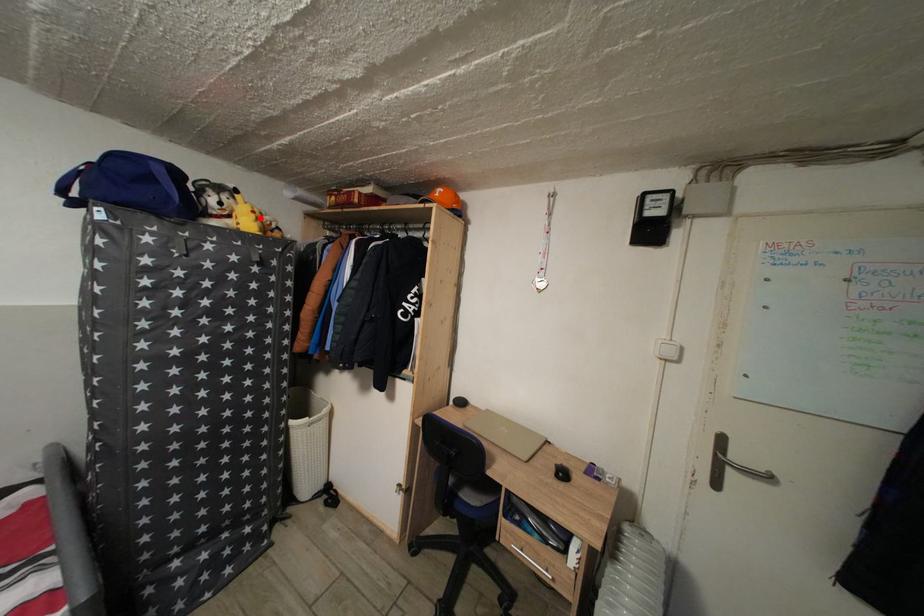
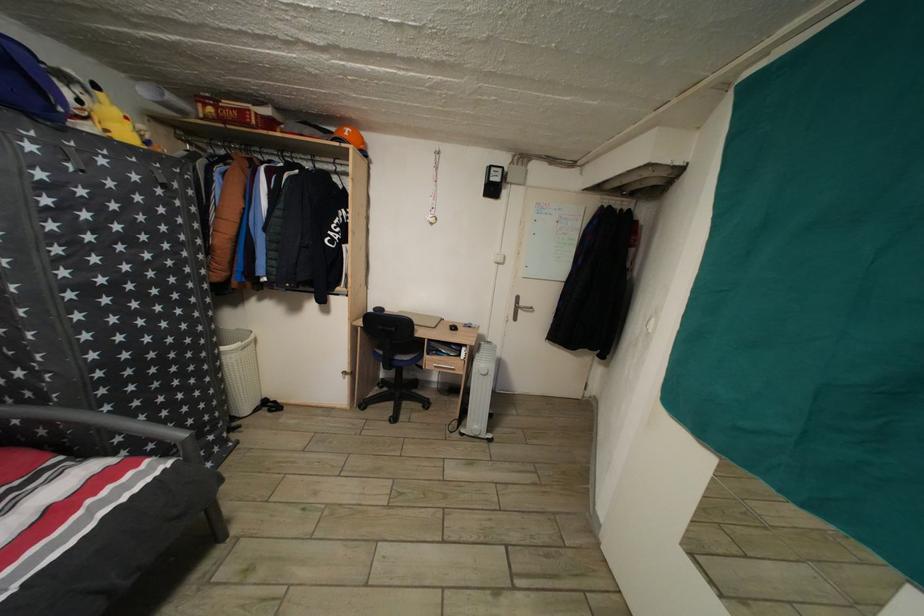
The point at the highlighted location is marked in the first image. Where is the corresponding point in the second image?

(134, 124)